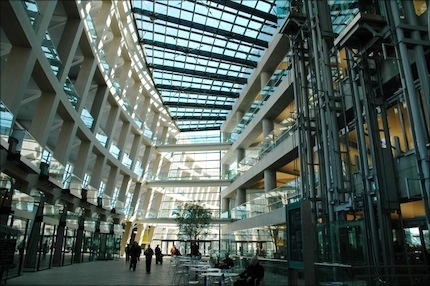
Image resolution: width=430 pixels, height=286 pixels. Find the location of `ceiling`. ceiling is located at coordinates (217, 48).